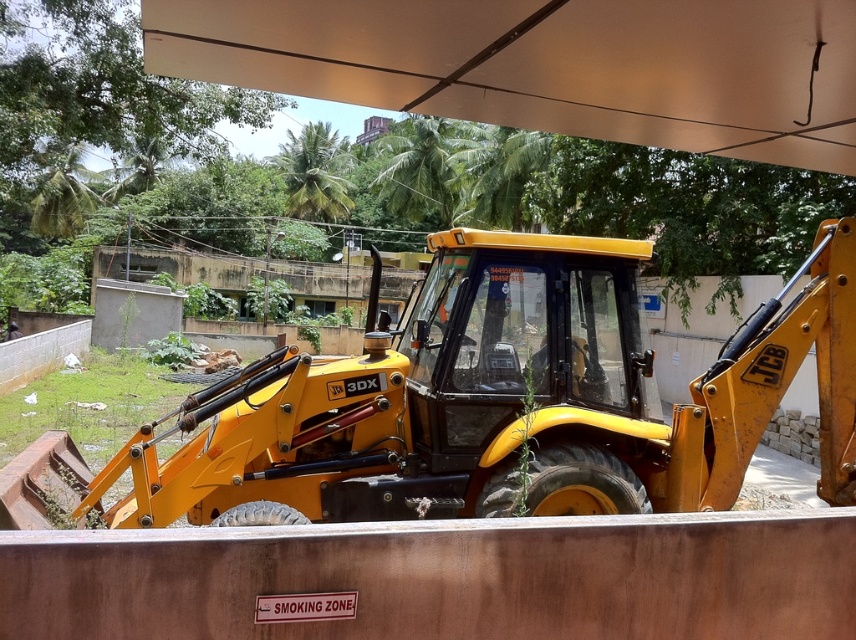
You are standing at the origin point of the coordinate system in the image. The yellow metallic tractor at center is located at point 0.631, 0.567. If you want to walk directly towards the tractor, which direction should you head?

Since the yellow metallic tractor at center is located at coordinates 0.631 on the x axis and 0.567 on the y axis, you should head northeast to reach it from the origin point.

You are a safety inspector standing at the camera position. You need to inspect the yellow metallic tractor at center. Can you walk directly to it without moving any obstacles?

The yellow metallic tractor at center is 5.31 meters away from the camera, so yes, you can walk directly to it without needing to move any obstacles as there is enough space.